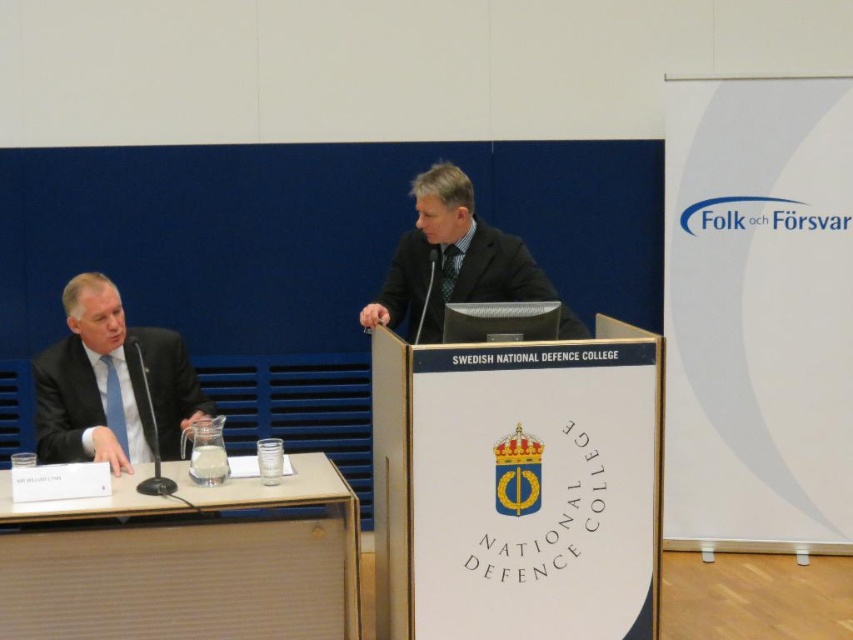
You are organizing a conference and need to ensure there is enough space between the light brown wood table at lower left and the matte black suit at left for attendees to walk comfortably. The recommended minimum distance for a walkway is 15 inches. Based on the scene, is the current spacing sufficient?

The light brown wood table at lower left is 14.62 inches away from the matte black suit at left, which is slightly less than the recommended 15 inches. Therefore, the current spacing is not sufficient for a comfortable walkway.

You are an event planner arranging seating for a conference. You need to place a name tag on the table for the speaker in the matte black suit at left and the speaker in the dark gray suit at center. According to the image, which speaker should have their name tag placed to the left side of the table?

The matte black suit at left should have their name tag placed to the left side of the table since they are positioned on the left side of the dark gray suit at center.

You are sitting in the audience and want to pass a note to the person in the dark gray suit at center. The light brown wood table at lower left is between you and them. Can you reach them without moving around the table?

The light brown wood table at lower left is closer to the viewer than the dark gray suit at center, so the table is in the way. You would need to move around the table to reach the person in the dark gray suit at center.